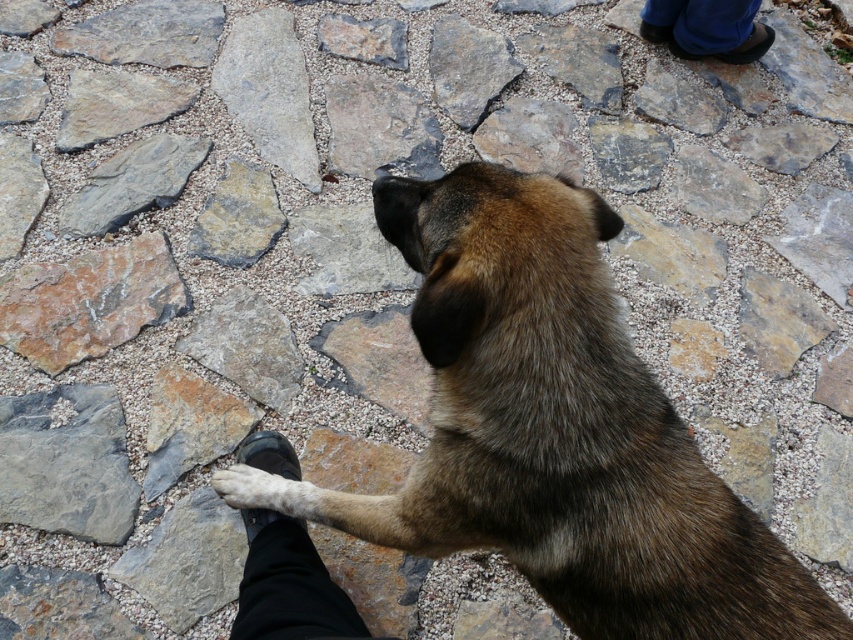
Which is in front, point (540, 396) or point (677, 22)?

Point (540, 396) is in front.

Which is above, brown furry dog at center or blue denim pants at upper right?

blue denim pants at upper right is above.

The width and height of the screenshot is (853, 640). I want to click on brown furry dog at center, so click(x=554, y=429).

Is brown furry dog at center taller than rusty metal stone at upper center?

Yes.

Does brown furry dog at center appear over rusty metal stone at upper center?

No, brown furry dog at center is not above rusty metal stone at upper center.

Which is behind, point (509, 444) or point (361, 22)?

The point (361, 22) is behind.

Locate an element on the screen. Image resolution: width=853 pixels, height=640 pixels. brown furry dog at center is located at coordinates click(554, 429).

Is brown furry dog at center further to camera compared to black leather shoe at lower center?

No, brown furry dog at center is closer to the viewer.

In order to click on brown furry dog at center in this screenshot , I will do `click(554, 429)`.

Find the location of a particular element. The height and width of the screenshot is (640, 853). brown furry dog at center is located at coordinates (554, 429).